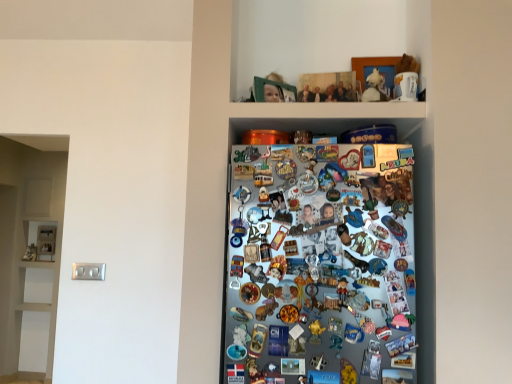
Question: Would you say white plush toy at upper center, which is the first toy from right to left, is inside or outside gold plastic toy at center, the second toy viewed from the back?

Choices:
 (A) outside
 (B) inside

Answer: (A)

Question: Considering the positions of point (373, 79) and point (318, 332), is point (373, 79) closer or farther from the camera than point (318, 332)?

Choices:
 (A) farther
 (B) closer

Answer: (A)

Question: Based on their sizes in the image, would you say white plush toy at upper center, the first toy when ordered from back to front, is bigger or smaller than gold plastic toy at center, the second toy positioned from the top?

Choices:
 (A) small
 (B) big

Answer: (B)

Question: Would you say gold plastic toy at center, the second toy in the right-to-left sequence, is to the left or to the right of white plush toy at upper center, acting as the first toy starting from the top, in the picture?

Choices:
 (A) right
 (B) left

Answer: (B)

Question: Is gold plastic toy at center, the first toy ordered from the bottom, bigger or smaller than white plush toy at upper center, the first toy when ordered from back to front?

Choices:
 (A) small
 (B) big

Answer: (A)

Question: Choose the correct answer: Is gold plastic toy at center, the second toy in the right-to-left sequence, inside white plush toy at upper center, the first toy when ordered from back to front, or outside it?

Choices:
 (A) inside
 (B) outside

Answer: (B)

Question: Considering the positions of gold plastic toy at center, the first toy ordered from the bottom, and white plush toy at upper center, arranged as the 2th toy when ordered from the bottom, in the image, is gold plastic toy at center, the first toy ordered from the bottom, wider or thinner than white plush toy at upper center, arranged as the 2th toy when ordered from the bottom,?

Choices:
 (A) thin
 (B) wide

Answer: (A)